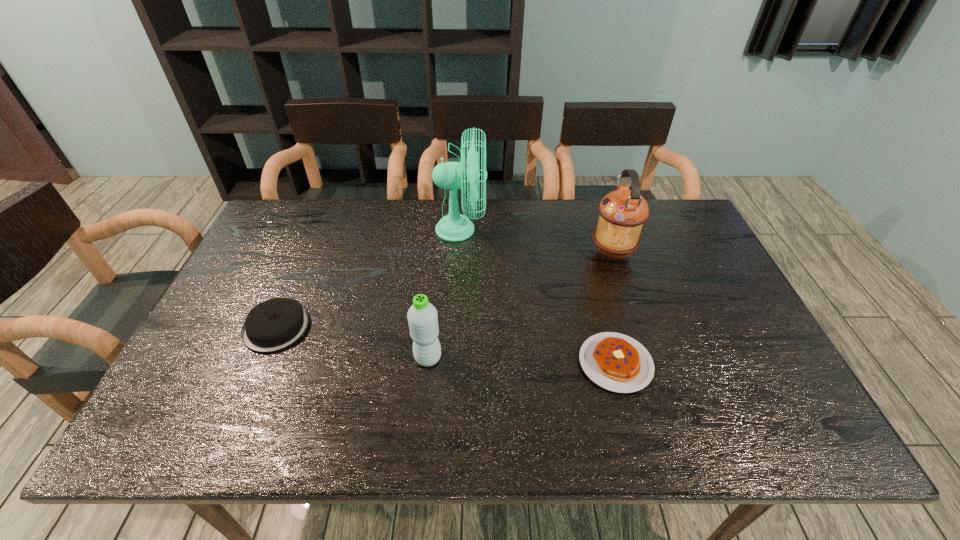
At what (x,y) coordinates should I click in order to perform the action: click on fan. Please return your answer as a coordinate pair (x, y). The image size is (960, 540). Looking at the image, I should click on (454, 227).

The height and width of the screenshot is (540, 960). Identify the location of oil lamp. (623, 212).

Where is `the third tallest object`? the third tallest object is located at coordinates (422, 317).

This screenshot has height=540, width=960. I want to click on the left pancake, so click(x=275, y=324).

I want to click on the second shortest object, so click(x=275, y=324).

This screenshot has height=540, width=960. In order to click on the right pancake in this screenshot , I will do `click(614, 361)`.

Identify the location of the shortest object. The image size is (960, 540). coord(614,361).

Where is `vacant space located in front of the fan to blow air`? The height and width of the screenshot is (540, 960). vacant space located in front of the fan to blow air is located at coordinates (561, 230).

Locate an element on the screen. This screenshot has height=540, width=960. vacant area situated 0.220m on the back of the oil lamp is located at coordinates (594, 200).

Identify the location of blank area located 0.190m on the front of the third shortest object. [x=419, y=447].